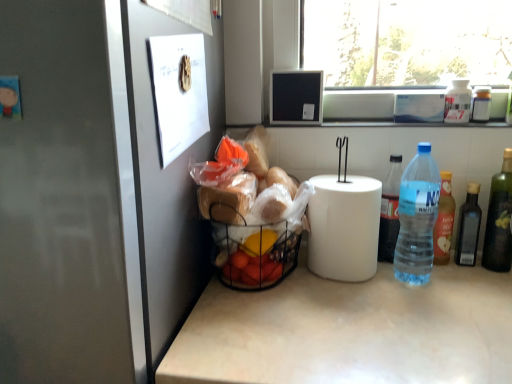
Where is `vacant area that lies between black matte frame at upper center and white plastic bottle at upper right, acting as the fourth bottle starting from the right`? Image resolution: width=512 pixels, height=384 pixels. vacant area that lies between black matte frame at upper center and white plastic bottle at upper right, acting as the fourth bottle starting from the right is located at coordinates (384, 125).